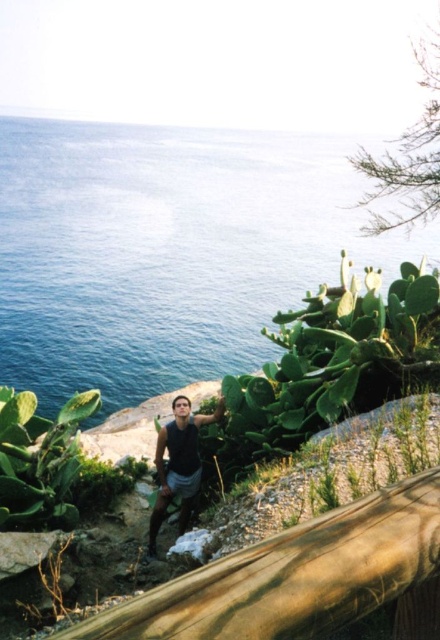
Question: Can you confirm if blue water at upper left is wider than matte black tank top at center?

Choices:
 (A) no
 (B) yes

Answer: (B)

Question: Which of the following is the farthest from the observer?

Choices:
 (A) (139, 333)
 (B) (194, 467)

Answer: (A)

Question: Does blue water at upper left have a larger size compared to matte black tank top at center?

Choices:
 (A) yes
 (B) no

Answer: (A)

Question: Which point is farther to the camera?

Choices:
 (A) (326, 138)
 (B) (184, 426)

Answer: (A)

Question: Does blue water at upper left have a larger size compared to matte black tank top at center?

Choices:
 (A) no
 (B) yes

Answer: (B)